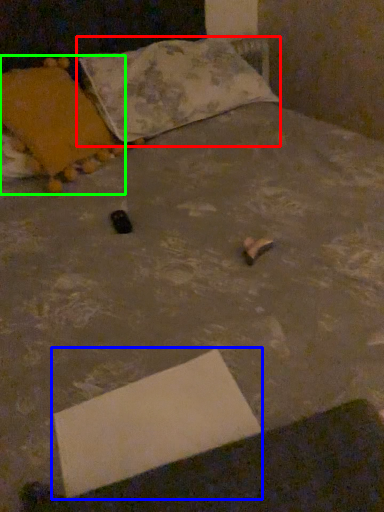
Question: Based on their relative distances, which object is nearer to pillow (highlighted by a red box)? Choose from cardboard box (highlighted by a blue box) and pillow (highlighted by a green box).

Choices:
 (A) cardboard box
 (B) pillow

Answer: (B)